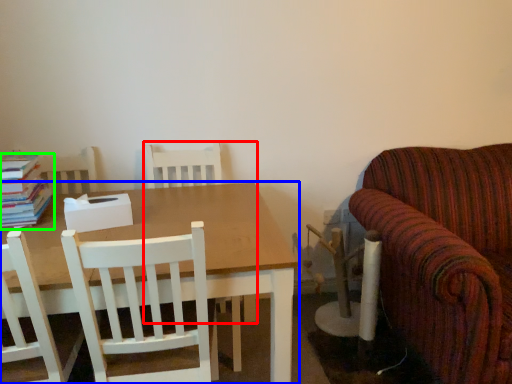
Question: Estimate the real-world distances between objects in this image. Which object is closer to chair (highlighted by a red box), table (highlighted by a blue box) or book (highlighted by a green box)?

Choices:
 (A) table
 (B) book

Answer: (A)